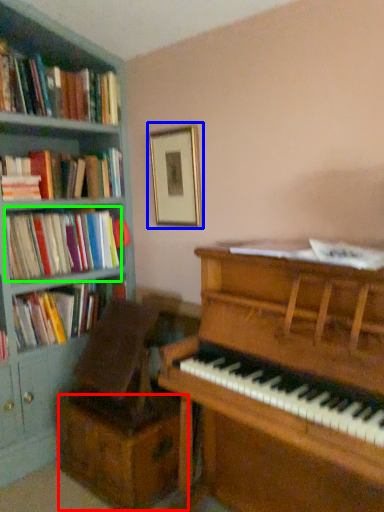
Question: Considering the real-world distances, which object is farthest from drawer (highlighted by a red box)? picture frame (highlighted by a blue box) or book (highlighted by a green box)?

Choices:
 (A) picture frame
 (B) book

Answer: (A)